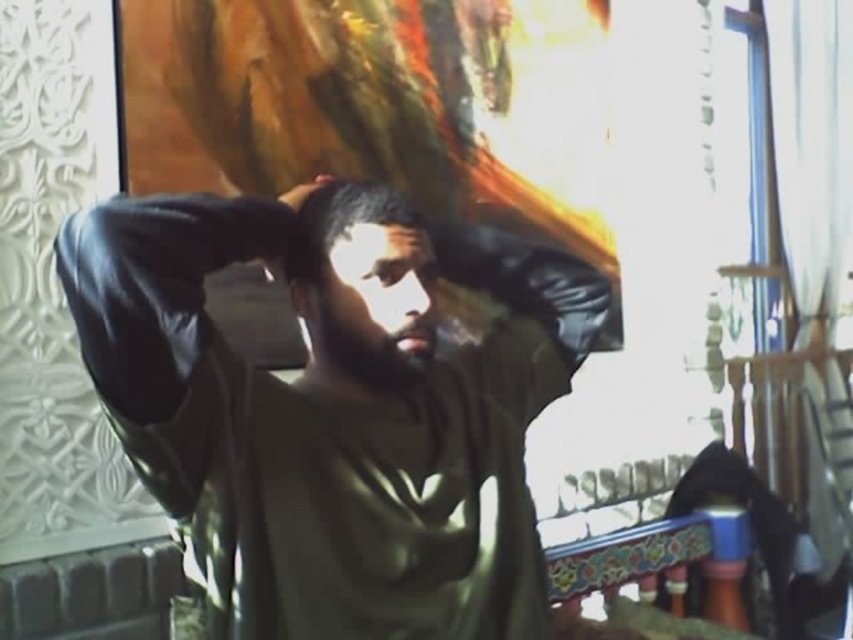
Is dark green fabric at center positioned in front of black leather hand at upper center?

Yes, it is in front of black leather hand at upper center.

Measure the distance between dark green fabric at center and camera.

They are 38.63 inches apart.

Between point (335, 220) and point (287, 204), which one is positioned in front?

Point (335, 220) is in front.

I want to click on dark green fabric at center, so click(x=360, y=284).

Does leather jacket at center come in front of dark matte hair at center?

Yes, leather jacket at center is in front of dark matte hair at center.

Can you confirm if leather jacket at center is thinner than dark matte hair at center?

No, leather jacket at center is not thinner than dark matte hair at center.

Which is behind, point (202, 278) or point (283, 266)?

The point (283, 266) is behind.

The image size is (853, 640). What are the coordinates of `leather jacket at center` in the screenshot? It's located at (337, 406).

Is leather jacket at center further to camera compared to dark green fabric at center?

No, it is not.

Does leather jacket at center have a greater width compared to dark green fabric at center?

Yes, leather jacket at center is wider than dark green fabric at center.

Measure the distance between point (x=280, y=467) and camera.

Point (x=280, y=467) is 36.96 inches from camera.

The height and width of the screenshot is (640, 853). What are the coordinates of `leather jacket at center` in the screenshot? It's located at (337, 406).